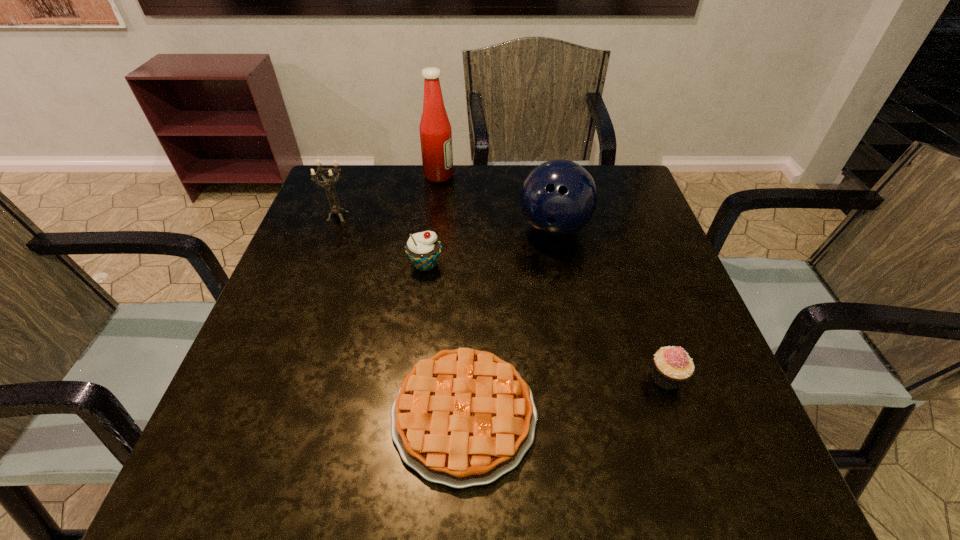
Locate an element on the screen. The height and width of the screenshot is (540, 960). free space between the taller cupcake and the pie is located at coordinates (444, 340).

Find the location of a particular element. The height and width of the screenshot is (540, 960). free area in between the bowling ball and the tallest object is located at coordinates (496, 202).

Where is `vacant area between the bowling ball and the shortest object`? This screenshot has width=960, height=540. vacant area between the bowling ball and the shortest object is located at coordinates (509, 322).

Find the location of a particular element. free space that is in between the farthest object and the fourth tallest object is located at coordinates (432, 220).

Where is `free space between the fourth tallest object and the candle holder`? This screenshot has height=540, width=960. free space between the fourth tallest object and the candle holder is located at coordinates (381, 240).

Locate an element on the screen. The height and width of the screenshot is (540, 960). free point between the third tallest object and the farther cupcake is located at coordinates (381, 240).

Find the location of a particular element. This screenshot has height=540, width=960. empty space between the taller cupcake and the tallest object is located at coordinates (432, 220).

The image size is (960, 540). What are the coordinates of `vacant area between the tallest object and the nearer cupcake` in the screenshot? It's located at (553, 276).

Select which object is the third closest to the bowling ball. Please provide its 2D coordinates. Your answer should be formatted as a tuple, i.e. [(x, y)], where the tuple contains the x and y coordinates of a point satisfying the conditions above.

[(462, 418)]

Identify the location of object that ranks as the closest to the third tallest object. The image size is (960, 540). (423, 249).